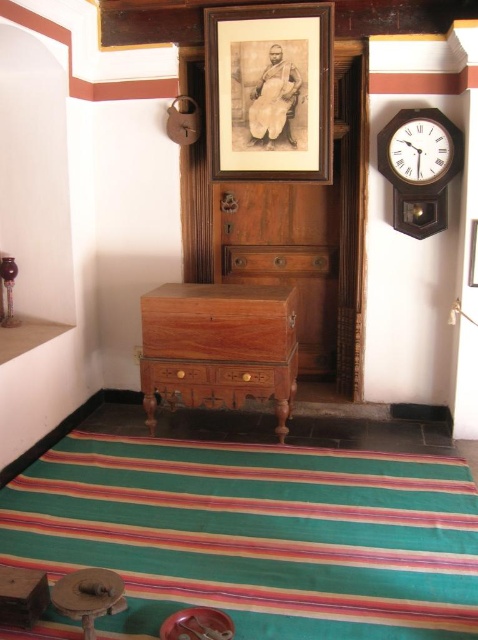
You are a visitor standing in the room and want to touch both the wooden frame at upper center and the mahogany wood dresser at center. Which object will you reach first?

You will reach the wooden frame at upper center first because it is closer to you than the mahogany wood dresser at center, which is further away.

You are standing in the room and want to place a 3.5 meter long ladder between the wooden frame at upper center and the clock on the right. Is there enough space?

The distance between the wooden frame at upper center and the clock on the right is 3.37 meters, which is shorter than the ladder length of 3.5 meters. Therefore, the ladder cannot be placed between them as it would not fit.